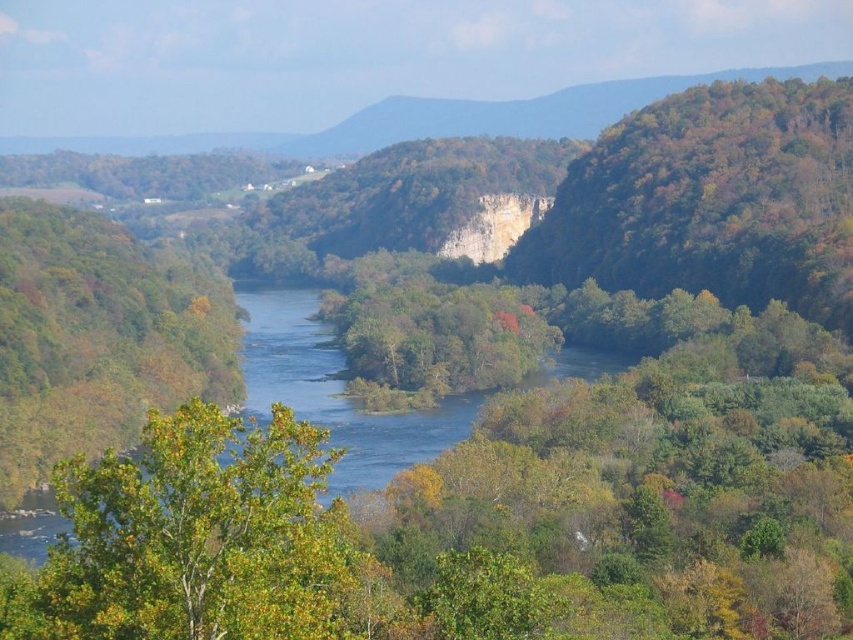
You are a hiker standing at the edge of the winding river in the valley. You notice a green leafy tree at left and some green leafy trees at center. Which group of trees is taller?

The green leafy tree at left is much taller than the green leafy trees at center.

You are standing at the center of the image and want to locate the green leafy tree at left. Which direction should you look to find it?

You should look to the left to find the green leafy tree at left since it is positioned at the left side of the image.

Consider the image. You are standing at the center of the image and want to locate the green leafy tree at right. Which direction should you look to find it?

You should look to the right to find the green leafy tree at right, as it is located at point (711, 200), which is to the right side of the image.